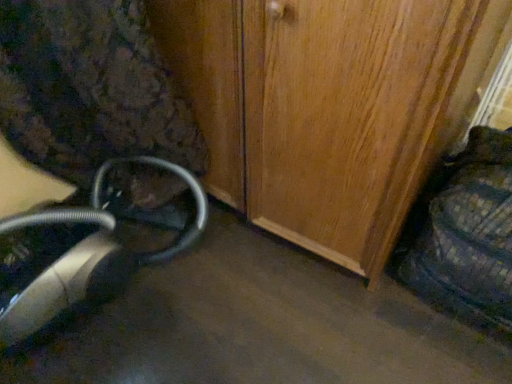
Question: In the image, is metallic silver vacuum cleaner at lower left positioned in front of or behind plaid fabric swivel chair at right?

Choices:
 (A) front
 (B) behind

Answer: (B)

Question: Does point (190, 226) appear closer or farther from the camera than point (459, 259)?

Choices:
 (A) closer
 (B) farther

Answer: (B)

Question: From the image's perspective, is metallic silver vacuum cleaner at lower left located above or below plaid fabric swivel chair at right?

Choices:
 (A) above
 (B) below

Answer: (B)

Question: Is plaid fabric swivel chair at right in front of or behind metallic silver vacuum cleaner at lower left in the image?

Choices:
 (A) behind
 (B) front

Answer: (B)

Question: From a real-world perspective, relative to metallic silver vacuum cleaner at lower left, is plaid fabric swivel chair at right vertically above or below?

Choices:
 (A) above
 (B) below

Answer: (A)

Question: Is plaid fabric swivel chair at right inside the boundaries of metallic silver vacuum cleaner at lower left, or outside?

Choices:
 (A) inside
 (B) outside

Answer: (B)

Question: In terms of height, does plaid fabric swivel chair at right look taller or shorter compared to metallic silver vacuum cleaner at lower left?

Choices:
 (A) tall
 (B) short

Answer: (A)